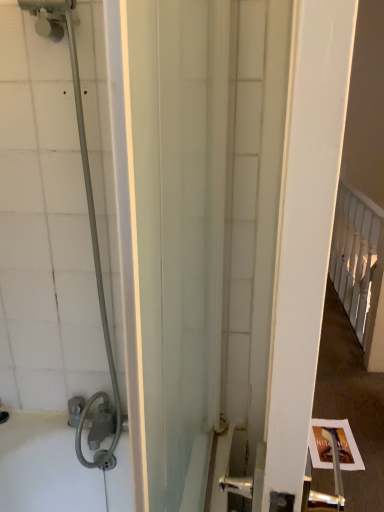
Identify the location of white wooden railing at right. (355, 256).

Image resolution: width=384 pixels, height=512 pixels. What do you see at coordinates (355, 256) in the screenshot?
I see `white wooden railing at right` at bounding box center [355, 256].

Locate an element on the screen. white wooden railing at right is located at coordinates (355, 256).